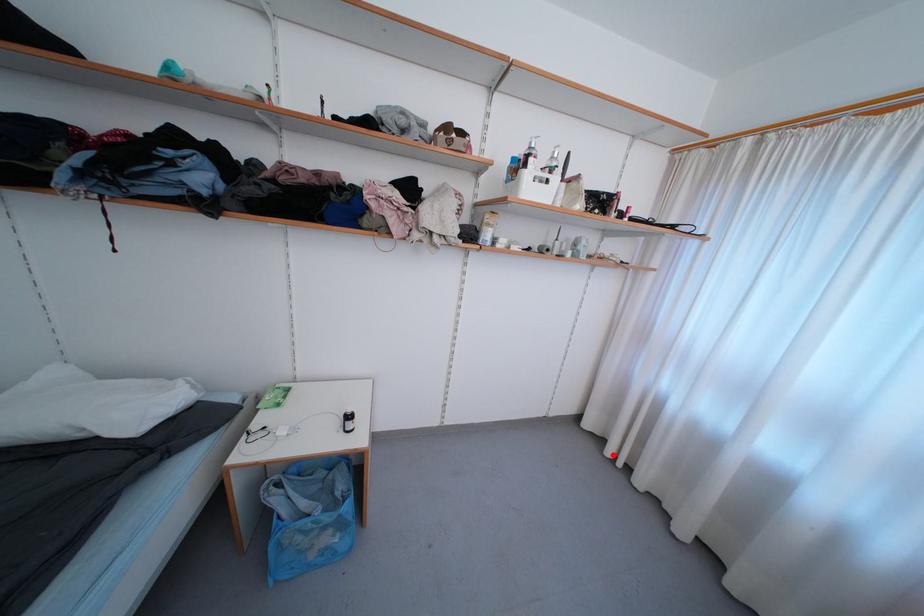
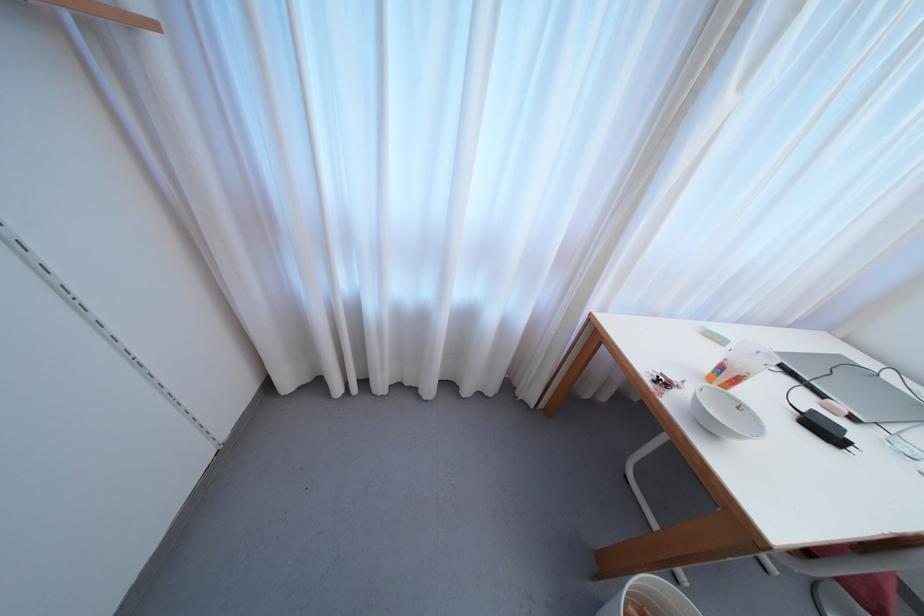
Question: I am providing you with two images of the same scene from different viewpoints. A red point is shown in image1. For the corresponding object point in image2, is it positioned nearer or farther from the camera?

Choices:
 (A) Nearer
 (B) Farther

Answer: (B)